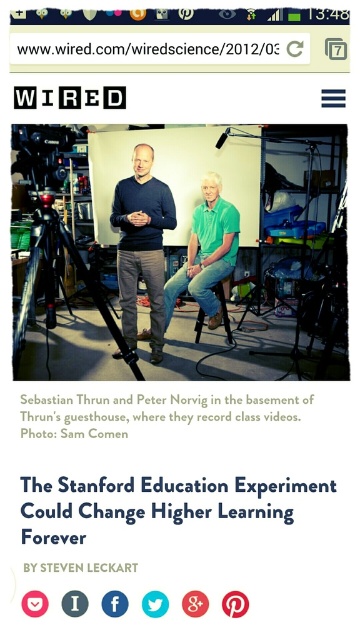
Is black plastic video camera at upper left to the right of matte plastic stool at center from the viewer's perspective?

No, black plastic video camera at upper left is not to the right of matte plastic stool at center.

Which of these two, black plastic video camera at upper left or matte plastic stool at center, stands shorter?

black plastic video camera at upper left is shorter.

Which is in front, point (21, 150) or point (218, 284)?

Point (21, 150)

Identify the location of black plastic video camera at upper left. This screenshot has width=360, height=640. (42, 152).

Between white paper at center and black plastic video camera at upper left, which one is positioned higher?

black plastic video camera at upper left is above.

Who is positioned more to the right, white paper at center or black plastic video camera at upper left?

white paper at center is more to the right.

Is point (174, 497) positioned behind point (32, 168)?

No.

In order to click on white paper at center in this screenshot , I will do `click(271, 497)`.

Between matte black sweater at center and white paper at center, which one is positioned higher?

Positioned higher is matte black sweater at center.

Looking at this image, is matte black sweater at center wider than white paper at center?

In fact, matte black sweater at center might be narrower than white paper at center.

Image resolution: width=360 pixels, height=640 pixels. Describe the element at coordinates (141, 244) in the screenshot. I see `matte black sweater at center` at that location.

The height and width of the screenshot is (640, 360). In order to click on matte black sweater at center in this screenshot , I will do `click(141, 244)`.